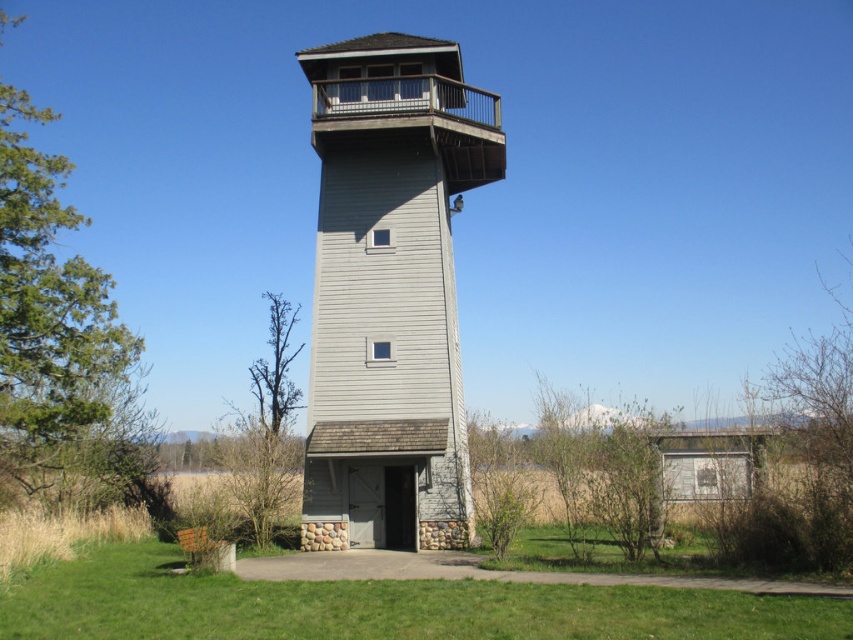
You are planning to build a small garden in the area around the gray wood tower at center and the green grass at lower center. Considering their sizes, which object would require more space to accommodate the garden?

The gray wood tower at center has a larger size compared to green grass at lower center, so it would require more space to accommodate the garden.

Consider the image. You are standing on the green grass at lower center and want to reach the gray wood tower at center. Which direction should you move to get there?

You should move to your right since the gray wood tower at center is located to the right of the green grass at lower center.